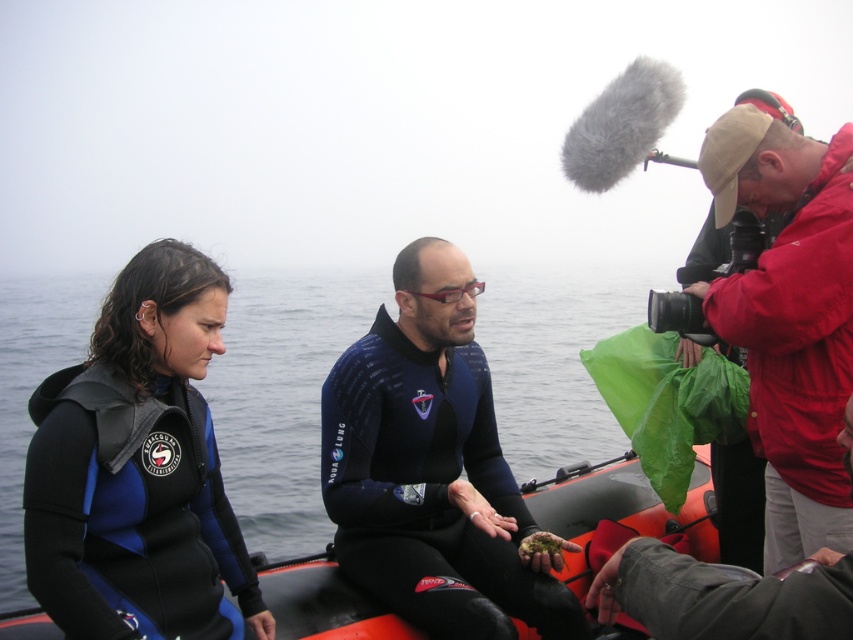
You are a photographer on a boat and want to capture both the blue matte wetsuit at left and the blue neoprene wetsuit at center in a single shot. Which wetsuit will appear larger in the photo?

The blue matte wetsuit at left will appear larger in the photo because it is closer to the viewer than the blue neoprene wetsuit at center.

You are a photographer on a boat and need to capture both the red jacket at upper right and the red matte jacket at upper right in a single shot. Which jacket should you focus on first if you want to ensure both are in frame without moving the camera?

You should focus on the red jacket at upper right first because it is larger in size compared to the red matte jacket at upper right, ensuring it fits within the frame while the smaller one also stays visible.

You are standing on the deck of a research vessel and see the blue neoprene wetsuit at center. If you want to throw a lifebuoy to the person wearing it, and the lifebuoy has a diameter of 1.5 meters, will the distance be within the recommended 15 feet safety range for accurate throws?

The blue neoprene wetsuit at center and viewer are 13.30 feet apart from each other. Since 13.30 feet is less than 15 feet, the distance is within the recommended safety range for accurate throws.